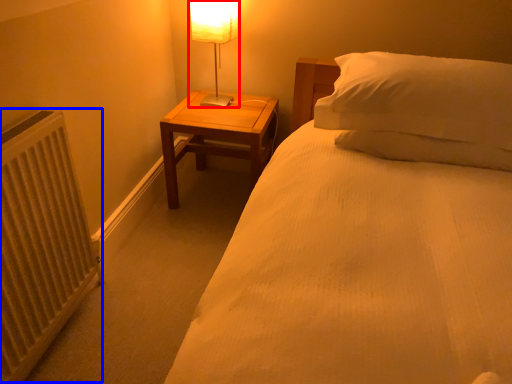
Question: Among these objects, which one is farthest to the camera, table lamp (highlighted by a red box) or radiator (highlighted by a blue box)?

Choices:
 (A) table lamp
 (B) radiator

Answer: (A)